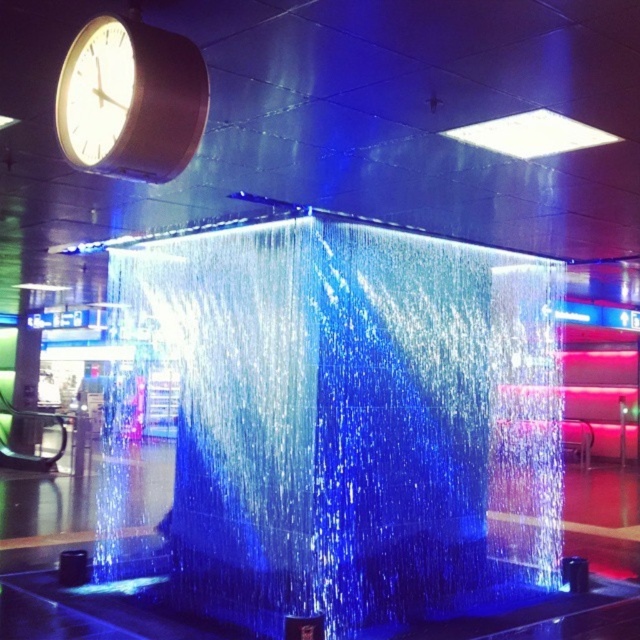
You are designing a layout for a new office space and need to ensure that the translucent glass cube at center and the matte black clock at upper left will fit within a 3 meter wide display area. The clock is 1.2 meters wide. Can both objects fit side by side without overlapping?

The matte black clock at upper left is 1.2 meters wide. If the translucent glass cube at center is wider than the clock, then the combined width would exceed 3 meters, making it impossible to fit both side by side. However, if the cube is narrower, they might fit. Since the description states the cube might be wider, there is a possibility they won not fit.

You are standing in the room and want to see the time on the matte black clock at upper left. However, there is a translucent glass cube at center in the way. Can you still see the clock through the cube?

The matte black clock at upper left is behind the translucent glass cube at center, so yes, you can still see the clock through the translucent glass cube at center because it is made of transparent material.

You are designing a layout for a new indoor space and want to place a small potted plant between the translucent glass cube at center and the white glossy square at upper center. Given their sizes, which object should the plant be closer to?

The translucent glass cube at center is bigger than the white glossy square at upper center, so the plant should be placed closer to the white glossy square at upper center to maintain balance in the layout.